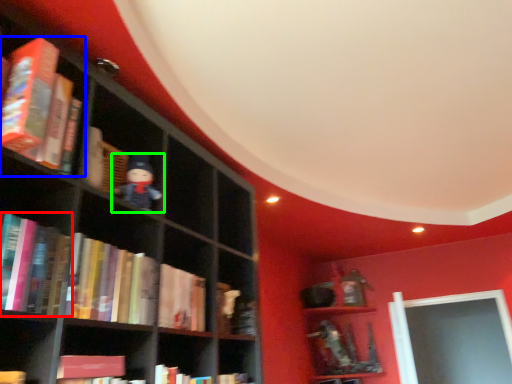
Question: Which object is the closest to the book (highlighted by a red box)? Choose among these: book (highlighted by a blue box) or toy (highlighted by a green box).

Choices:
 (A) book
 (B) toy

Answer: (A)